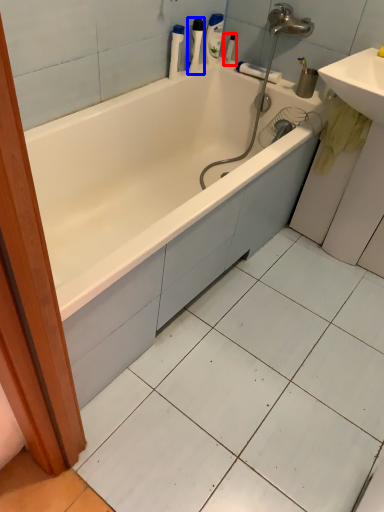
Question: Which object appears farthest to the camera in this image, toiletry (highlighted by a red box) or toiletry (highlighted by a blue box)?

Choices:
 (A) toiletry
 (B) toiletry

Answer: (A)